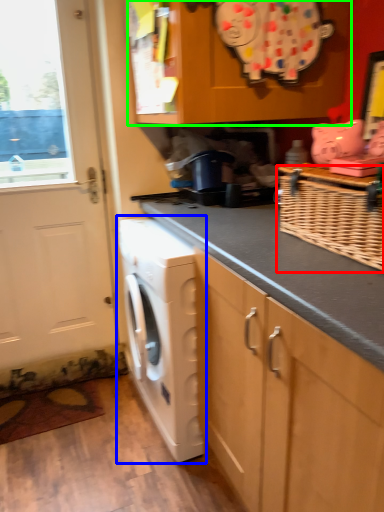
Question: Estimate the real-world distances between objects in this image. Which object is farther from basket (highlighted by a red box), washing machine (highlighted by a blue box) or cabinetry (highlighted by a green box)?

Choices:
 (A) washing machine
 (B) cabinetry

Answer: (A)